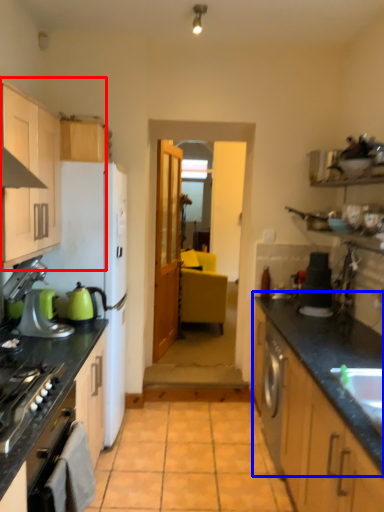
Question: Which object is further to the camera taking this photo, cabinetry (highlighted by a red box) or countertop (highlighted by a blue box)?

Choices:
 (A) cabinetry
 (B) countertop

Answer: (B)